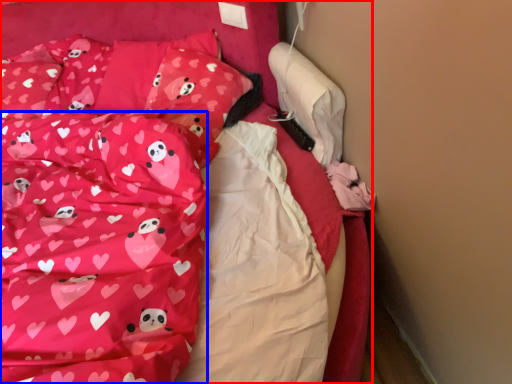
Question: Which point is further to the camera, bed (highlighted by a red box) or blanket (highlighted by a blue box)?

Choices:
 (A) bed
 (B) blanket

Answer: (A)